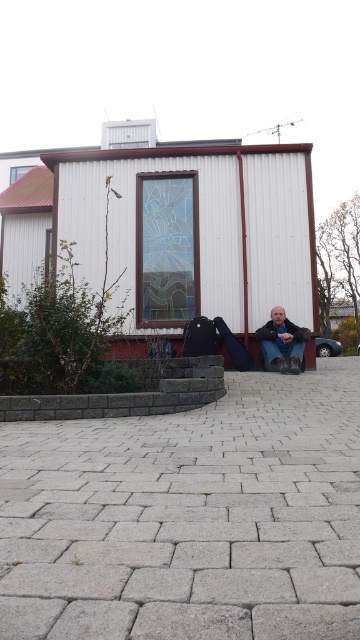
Is gray concrete pavement at center further to camera compared to matte black boots at lower center?

No, gray concrete pavement at center is closer to the viewer.

What do you see at coordinates (189, 516) in the screenshot? This screenshot has width=360, height=640. I see `gray concrete pavement at center` at bounding box center [189, 516].

Where is `gray concrete pavement at center`? This screenshot has width=360, height=640. gray concrete pavement at center is located at coordinates (189, 516).